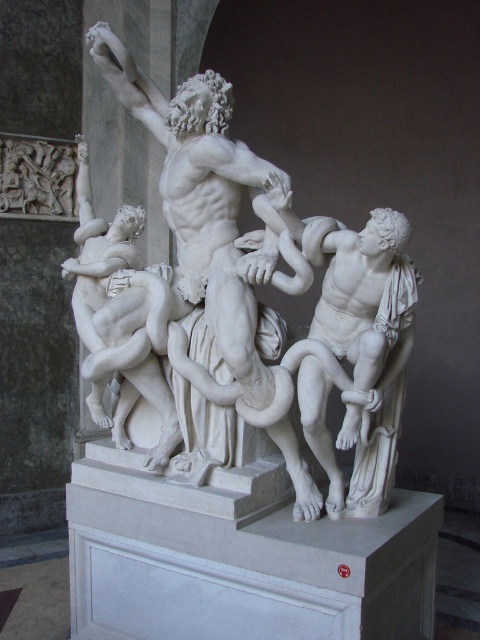
You are standing in front of the classical marble sculpture and want to touch both the white marble sculpture at center and the white marble figure at right. Which one can you reach first without moving your position?

The white marble sculpture at center can be reached first because it is closer to you than the white marble figure at right, which is further away.

You are an art curator planning to display the white marble sculpture at center and the white marble figure at right in a gallery. Considering their sizes, which one should be placed in the main exhibition area to emphasize its prominence?

The white marble sculpture at center should be placed in the main exhibition area because it has a larger size compared to the white marble figure at right, making it more prominent.

You are an art conservator examining the classical marble sculpture. You notice two points on the sculpture at coordinates point (x=370, y=300) and point (x=388, y=321). Which point is closer to the camera?

Point (x=370, y=300) is further to the camera than point (x=388, y=321), so the closer point to the camera is point (x=388, y=321).